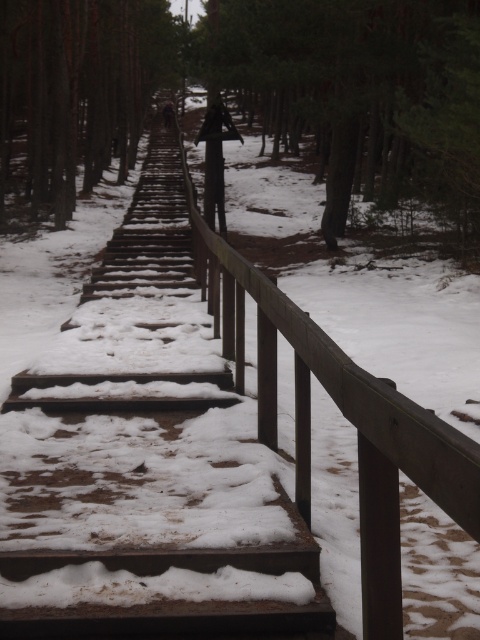
You are planning to place a decorative mat on the wooden stairs at center and the dark brown wood post at center. Considering their widths, which object would require a wider mat to cover its entire surface?

The dark brown wood post at center requires a wider mat because the wooden stairs at center has a lesser width compared to dark brown wood post at center.

You are standing at the point labeled as point (147,458) in the image. Looking around, you see wooden stairs at center. Which direction should you walk to reach the wooden stairs at center from your current position?

Since the point (147,458) corresponds to the wooden stairs at center, you are already at the wooden stairs at center. There is no need to walk further in any direction.